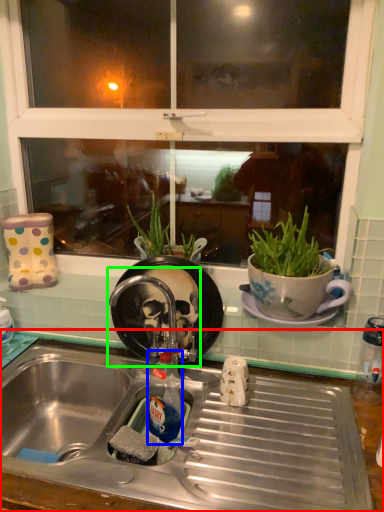
Question: Considering the real-world distances, which object is farthest from desk (highlighted by a red box)? bottle (highlighted by a blue box) or faucet (highlighted by a green box)?

Choices:
 (A) bottle
 (B) faucet

Answer: (B)